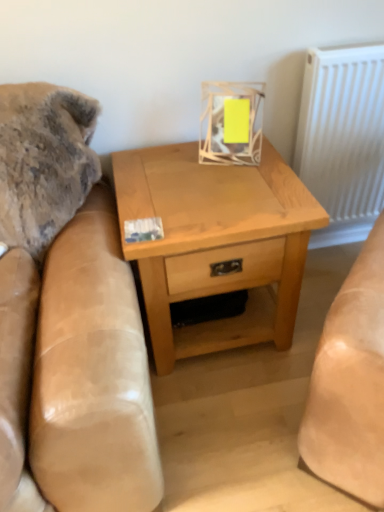
Where is `blank space situated above light wood/texture nightstand at center (from a real-world perspective)`? Image resolution: width=384 pixels, height=512 pixels. blank space situated above light wood/texture nightstand at center (from a real-world perspective) is located at coordinates (209, 176).